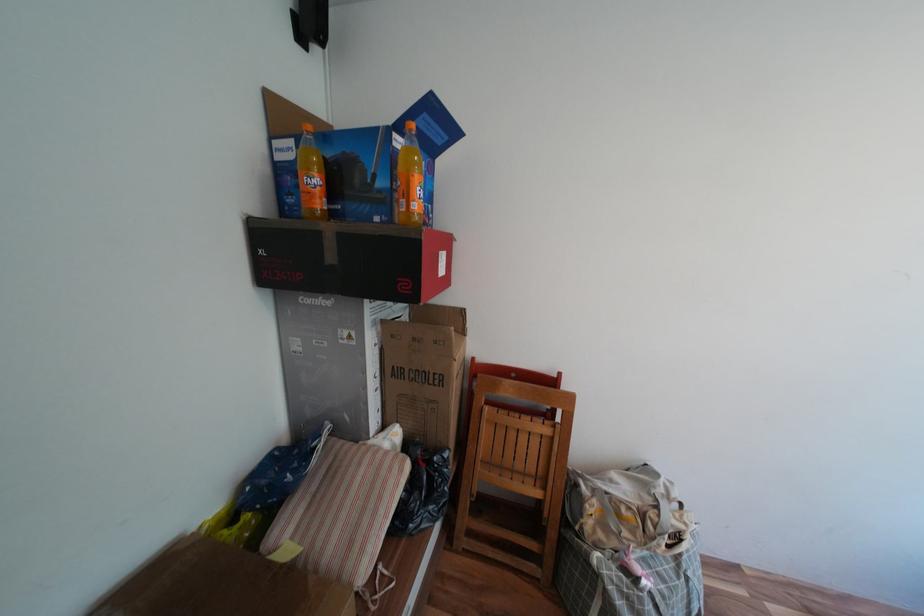
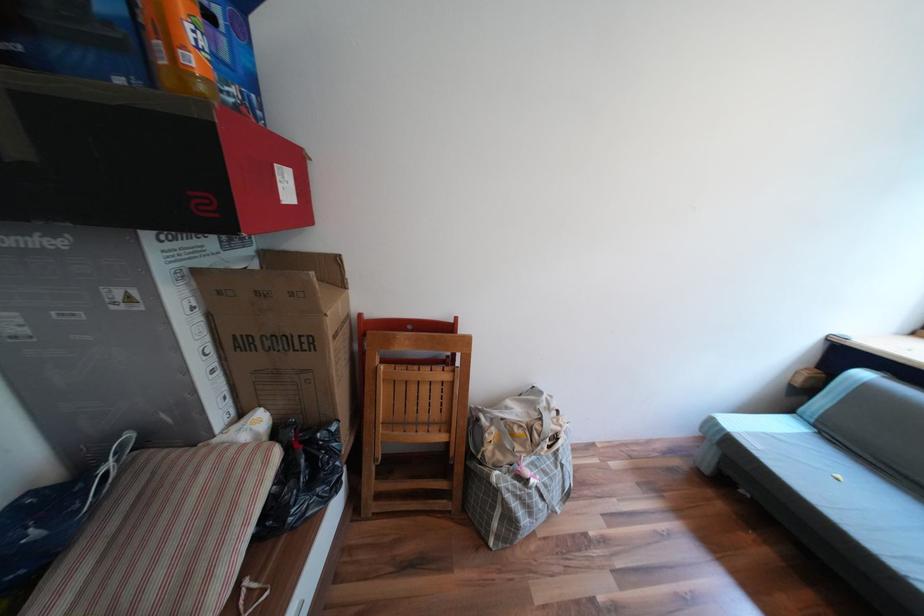
In the second image, find the point that corresponds to the point at 448,265 in the first image.

(289, 185)